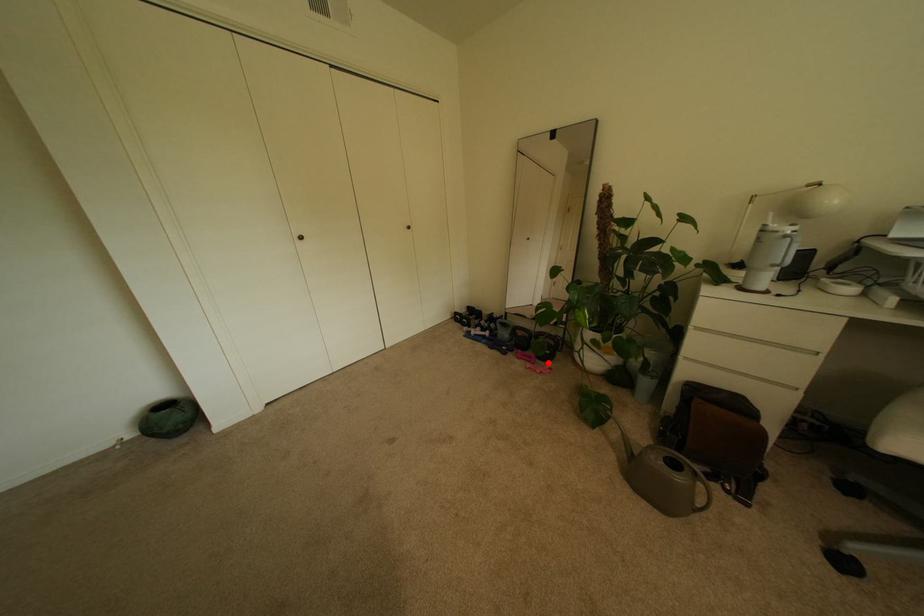
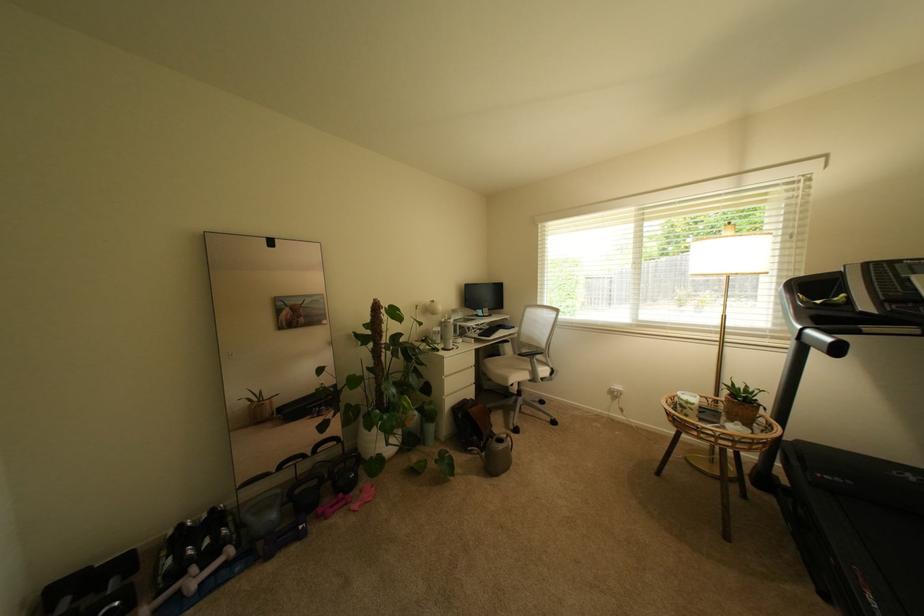
Question: A red point is marked in image1. In image2, is the corresponding 3D point closer to the camera or farther? Reply with the corresponding letter.

Choices:
 (A) The corresponding 3D point is closer.
 (B) The corresponding 3D point is farther.

Answer: (B)